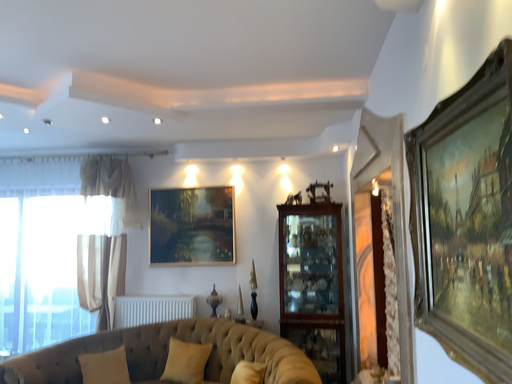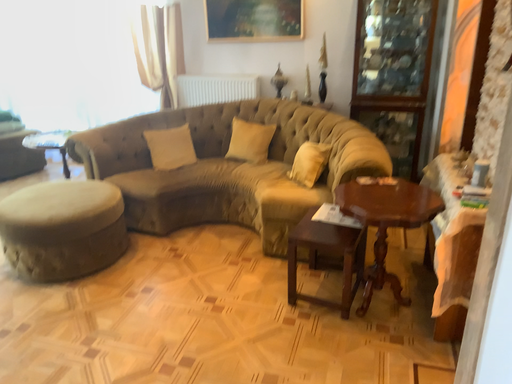
Question: Which way did the camera rotate in the video?

Choices:
 (A) rotated downward
 (B) rotated upward

Answer: (A)